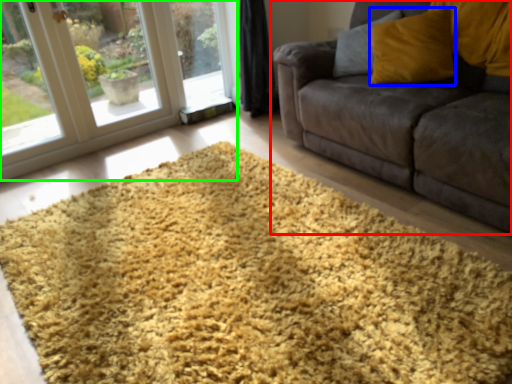
Question: Estimate the real-world distances between objects in this image. Which object is closer to studio couch (highlighted by a red box), throw pillow (highlighted by a blue box) or window (highlighted by a green box)?

Choices:
 (A) throw pillow
 (B) window

Answer: (A)